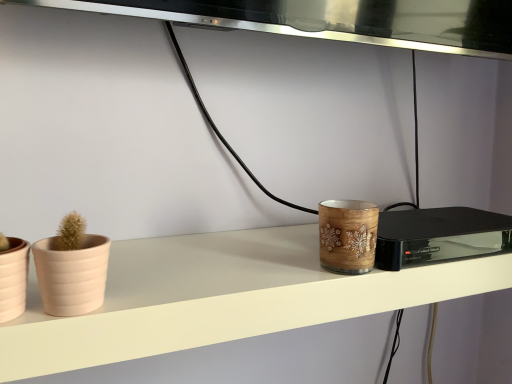
Measure the distance between point (385, 237) and camera.

They are 20.87 inches apart.

Describe the element at coordinates (347, 236) in the screenshot. I see `wooden candle holder at center` at that location.

What are the coordinates of `wooden candle holder at center` in the screenshot? It's located at (439, 236).

From a real-world perspective, is wooden candle holder at center physically below beige matte flowerpot at left, the first flowerpot from the right?

Yes.

Does wooden candle holder at center have a smaller size compared to beige matte flowerpot at left, positioned as the 2th flowerpot in left-to-right order?

Actually, wooden candle holder at center might be larger than beige matte flowerpot at left, positioned as the 2th flowerpot in left-to-right order.

At what (x,y) coordinates should I click in order to perform the action: click on the 2nd flowerpot above the wooden candle holder at center (from the image's perspective). Please return your answer as a coordinate pair (x, y). Looking at the image, I should click on (72, 275).

Does wooden candle holder at center appear on the right side of beige matte flowerpot at left, the first flowerpot from the right?

Yes.

Is wooden candle holder at center in front of or behind wooden candle holder at center in the image?

Clearly, wooden candle holder at center is in front of wooden candle holder at center.

From a real-world perspective, which is physically below, wooden candle holder at center or wooden candle holder at center?

wooden candle holder at center is physically lower.

You are a GUI agent. You are given a task and a screenshot of the screen. Output one action in this format:
    pyautogui.click(x=<x>, y=<y>)
    Task: Click on the shelf that appears below the wooden candle holder at center (from the image's perspective)
    Image resolution: width=512 pixels, height=384 pixels.
    Given the screenshot: What is the action you would take?
    pyautogui.click(x=221, y=298)

Would you say wooden candle holder at center is outside wooden candle holder at center?

Yes, wooden candle holder at center is outside of wooden candle holder at center.

Between point (86, 257) and point (9, 274), which one is positioned in front?

The point (9, 274) is more forward.

Would you consider beige matte flowerpot at left, the first flowerpot from the right, to be distant from matte pink flowerpot at left, which is the second flowerpot in right-to-left order?

They are positioned close to each other.

Is beige matte flowerpot at left, the first flowerpot from the right, inside the boundaries of matte pink flowerpot at left, which is the second flowerpot in right-to-left order, or outside?

The correct answer is: outside.

Considering their positions, is beige matte flowerpot at left, the first flowerpot from the right, located in front of or behind matte pink flowerpot at left, which is counted as the 1th flowerpot, starting from the left?

Visually, beige matte flowerpot at left, the first flowerpot from the right, is located behind matte pink flowerpot at left, which is counted as the 1th flowerpot, starting from the left.

Can you confirm if wooden candle holder at center is bigger than matte pink flowerpot at left, which is the second flowerpot in right-to-left order?

Yes.

Considering the positions of objects wooden candle holder at center and matte pink flowerpot at left, which is counted as the 1th flowerpot, starting from the left, in the image provided, who is more to the left, wooden candle holder at center or matte pink flowerpot at left, which is counted as the 1th flowerpot, starting from the left,?

From the viewer's perspective, matte pink flowerpot at left, which is counted as the 1th flowerpot, starting from the left, appears more on the left side.

Does wooden candle holder at center have a lesser width compared to matte pink flowerpot at left, which is counted as the 1th flowerpot, starting from the left?

No, wooden candle holder at center is not thinner than matte pink flowerpot at left, which is counted as the 1th flowerpot, starting from the left.

Could you tell me if matte pink flowerpot at left, which is the second flowerpot in right-to-left order, is turned towards wooden candle holder at center?

No, matte pink flowerpot at left, which is the second flowerpot in right-to-left order, is not facing towards wooden candle holder at center.

How much distance is there between matte pink flowerpot at left, which is counted as the 1th flowerpot, starting from the left, and wooden candle holder at center?

matte pink flowerpot at left, which is counted as the 1th flowerpot, starting from the left, is 19.17 inches away from wooden candle holder at center.

Which is in front, point (17, 258) or point (456, 243)?

Positioned in front is point (17, 258).

Can you confirm if matte pink flowerpot at left, which is counted as the 1th flowerpot, starting from the left, is bigger than wooden candle holder at center?

Actually, matte pink flowerpot at left, which is counted as the 1th flowerpot, starting from the left, might be smaller than wooden candle holder at center.

Can you see wooden candle holder at center touching wooden candle holder at center?

There is a gap between wooden candle holder at center and wooden candle holder at center.

Is wooden candle holder at center at the back of wooden candle holder at center?

That's not correct — wooden candle holder at center is not looking away from wooden candle holder at center.

Is wooden candle holder at center taller than wooden candle holder at center?

No.

From a real-world perspective, who is located higher, wooden candle holder at center or wooden candle holder at center?

In real-world perspective, wooden candle holder at center is above.

Which of these two, wooden candle holder at center or wooden candle holder at center, is wider?

With larger width is wooden candle holder at center.

Is wooden candle holder at center positioned with its back to wooden candle holder at center?

That's not correct — wooden candle holder at center is not looking away from wooden candle holder at center.

What are the coordinates of `the 1st flowerpot counting from the left of the wooden candle holder at center` in the screenshot? It's located at (72, 275).

Image resolution: width=512 pixels, height=384 pixels. In the image, there is a wooden candle holder at center. Identify the location of appliance above it (from the image's perspective). (439, 236).

When comparing their distances from wooden candle holder at center, does wooden candle holder at center or matte pink flowerpot at left, which is the second flowerpot in right-to-left order, seem closer?

Among the two, wooden candle holder at center is located nearer to wooden candle holder at center.

Which object lies nearer to the anchor point wooden candle holder at center, wooden candle holder at center or beige matte flowerpot at left, the first flowerpot from the right?

wooden candle holder at center lies closer to wooden candle holder at center than the other object.

Which object lies further to the anchor point beige matte flowerpot at left, positioned as the 2th flowerpot in left-to-right order, wooden candle holder at center or matte pink flowerpot at left, which is the second flowerpot in right-to-left order?

wooden candle holder at center is positioned further to the anchor beige matte flowerpot at left, positioned as the 2th flowerpot in left-to-right order.

Which object lies nearer to the anchor point wooden candle holder at center, beige matte flowerpot at left, positioned as the 2th flowerpot in left-to-right order, or matte pink flowerpot at left, which is counted as the 1th flowerpot, starting from the left?

Among the two, beige matte flowerpot at left, positioned as the 2th flowerpot in left-to-right order, is located nearer to wooden candle holder at center.

From the image, which object appears to be nearer to matte pink flowerpot at left, which is counted as the 1th flowerpot, starting from the left, wooden candle holder at center or beige matte flowerpot at left, positioned as the 2th flowerpot in left-to-right order?

beige matte flowerpot at left, positioned as the 2th flowerpot in left-to-right order, lies closer to matte pink flowerpot at left, which is counted as the 1th flowerpot, starting from the left, than the other object.

Looking at the image, which one is located further to wooden candle holder at center, wooden candle holder at center or matte pink flowerpot at left, which is counted as the 1th flowerpot, starting from the left?

matte pink flowerpot at left, which is counted as the 1th flowerpot, starting from the left, is further to wooden candle holder at center.

Based on the photo, based on their spatial positions, is wooden candle holder at center or wooden candle holder at center closer to wooden candle holder at center?

Based on the image, wooden candle holder at center appears to be nearer to wooden candle holder at center.

From the image, which object appears to be farther from wooden candle holder at center, wooden candle holder at center or beige matte flowerpot at left, positioned as the 2th flowerpot in left-to-right order?

Among the two, beige matte flowerpot at left, positioned as the 2th flowerpot in left-to-right order, is located further to wooden candle holder at center.

This screenshot has width=512, height=384. Find the location of `shelf between matte pink flowerpot at left, which is the second flowerpot in right-to-left order, and wooden candle holder at center from left to right`. shelf between matte pink flowerpot at left, which is the second flowerpot in right-to-left order, and wooden candle holder at center from left to right is located at coordinates pyautogui.click(x=221, y=298).

I want to click on pottery located between wooden candle holder at center and wooden candle holder at center in the left-right direction, so click(x=347, y=236).

Find the location of a particular element. Image resolution: width=512 pixels, height=384 pixels. shelf between beige matte flowerpot at left, the first flowerpot from the right, and wooden candle holder at center from left to right is located at coordinates click(x=221, y=298).

Find the location of a particular element. flowerpot located between matte pink flowerpot at left, which is the second flowerpot in right-to-left order, and wooden candle holder at center in the left-right direction is located at coordinates (72, 275).